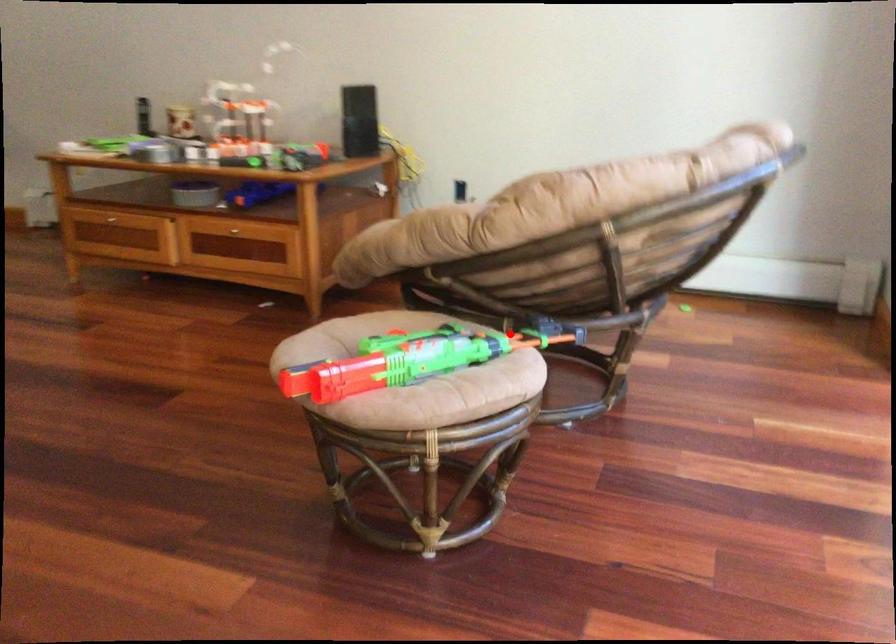
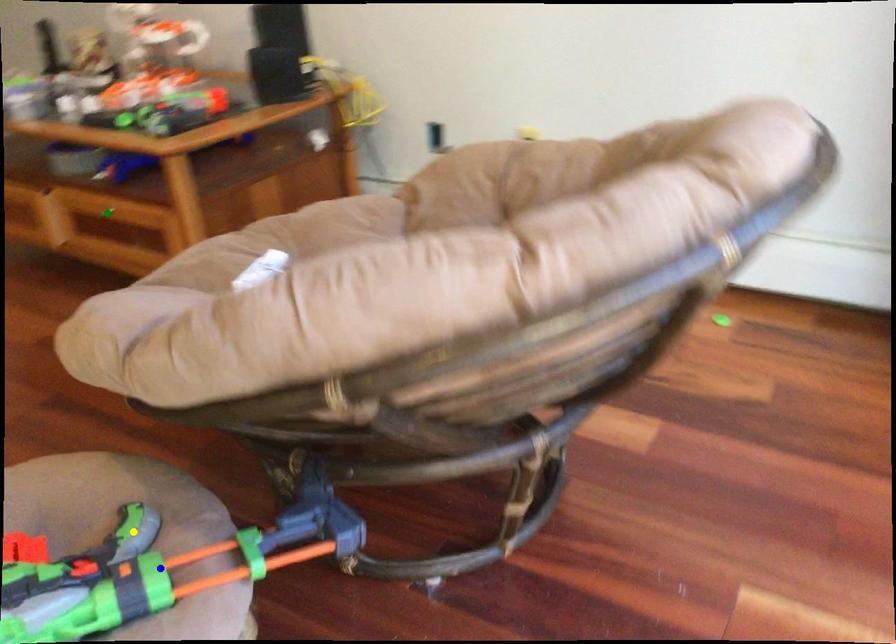
Question: I am providing you with two images of the same scene from different viewpoints. A red point is marked on the first image. You are given multiple points on the second image. Which mark in image 2 goes with the point in image 1?

Choices:
 (A) blue point
 (B) green point
 (C) yellow point

Answer: (A)